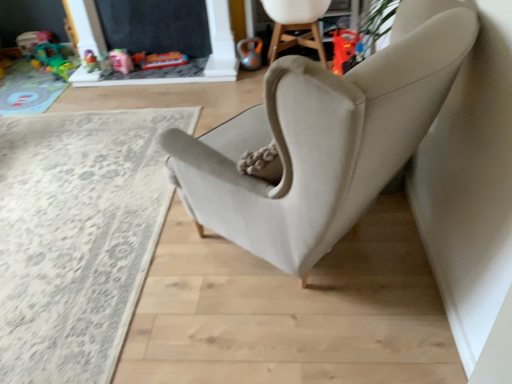
Question: Can you confirm if matte pink toy at upper left, positioned as the 3th toy in left-to-right order, is bigger than plastic toy car at upper center, positioned as the second toy in right-to-left order?

Choices:
 (A) yes
 (B) no

Answer: (B)

Question: From the image's perspective, is matte pink toy at upper left, arranged as the third toy when viewed from the right, located beneath plastic toy car at upper center, positioned as the second toy in right-to-left order?

Choices:
 (A) yes
 (B) no

Answer: (A)

Question: From a real-world perspective, is matte pink toy at upper left, arranged as the third toy when viewed from the right, below plastic toy car at upper center, positioned as the second toy in right-to-left order?

Choices:
 (A) yes
 (B) no

Answer: (B)

Question: Can you confirm if matte pink toy at upper left, arranged as the third toy when viewed from the right, is thinner than plastic toy car at upper center, positioned as the 4th toy in left-to-right order?

Choices:
 (A) yes
 (B) no

Answer: (A)

Question: Are matte pink toy at upper left, positioned as the 3th toy in left-to-right order, and plastic toy car at upper center, positioned as the second toy in right-to-left order, beside each other?

Choices:
 (A) yes
 (B) no

Answer: (B)

Question: Is matte pink toy at upper left, positioned as the 3th toy in left-to-right order, facing away from plastic toy car at upper center, positioned as the 4th toy in left-to-right order?

Choices:
 (A) no
 (B) yes

Answer: (A)

Question: Is translucent plastic toy at upper left, which is the fourth toy from right to left, oriented away from plastic toy car at upper center, positioned as the second toy in right-to-left order?

Choices:
 (A) no
 (B) yes

Answer: (A)

Question: Can you confirm if translucent plastic toy at upper left, which is the 2th toy from left to right, is shorter than plastic toy car at upper center, positioned as the second toy in right-to-left order?

Choices:
 (A) no
 (B) yes

Answer: (A)

Question: Are translucent plastic toy at upper left, which is the fourth toy from right to left, and plastic toy car at upper center, positioned as the 4th toy in left-to-right order, making contact?

Choices:
 (A) no
 (B) yes

Answer: (A)

Question: From the image's perspective, does translucent plastic toy at upper left, which is the fourth toy from right to left, appear lower than plastic toy car at upper center, positioned as the second toy in right-to-left order?

Choices:
 (A) no
 (B) yes

Answer: (A)

Question: From a real-world perspective, is translucent plastic toy at upper left, which is the 2th toy from left to right, positioned under plastic toy car at upper center, positioned as the second toy in right-to-left order, based on gravity?

Choices:
 (A) yes
 (B) no

Answer: (A)

Question: From a real-world perspective, is translucent plastic toy at upper left, which is the 2th toy from left to right, on top of plastic toy car at upper center, positioned as the second toy in right-to-left order?

Choices:
 (A) no
 (B) yes

Answer: (A)

Question: Does matte pink toy at upper left, positioned as the 3th toy in left-to-right order, come in front of translucent plastic toy at upper left, which is the 2th toy from left to right?

Choices:
 (A) no
 (B) yes

Answer: (B)